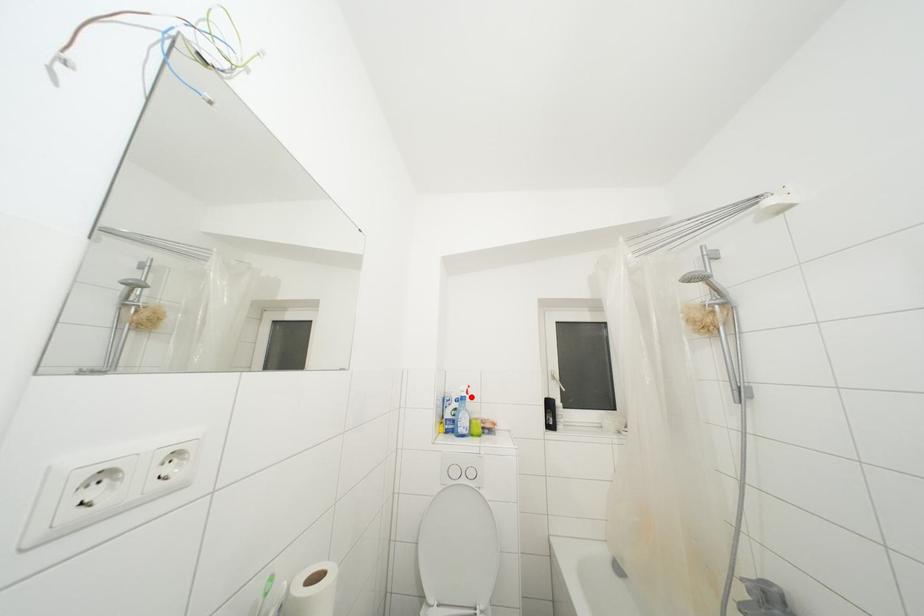
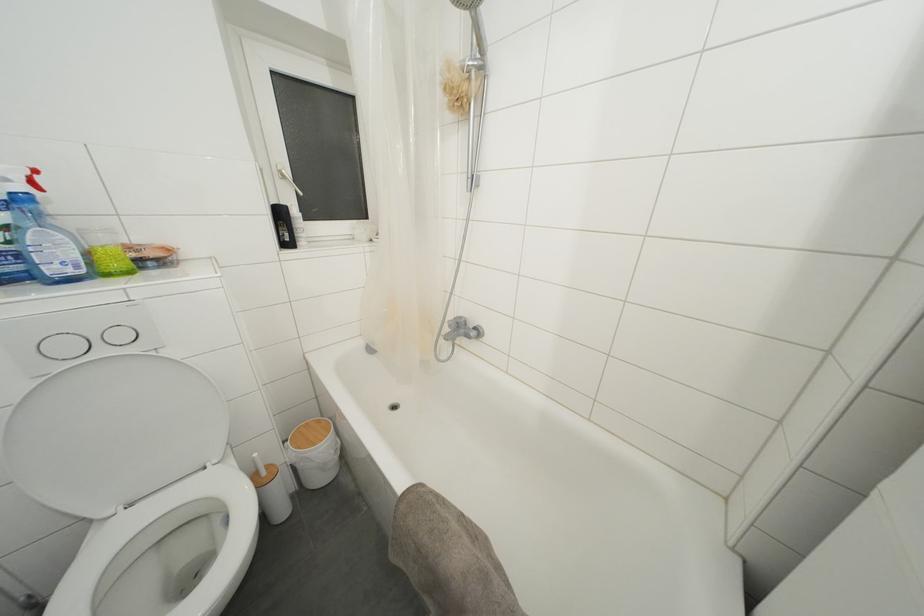
Where in the second image is the point corresponding to the highlighted location from the first image?

(37, 188)